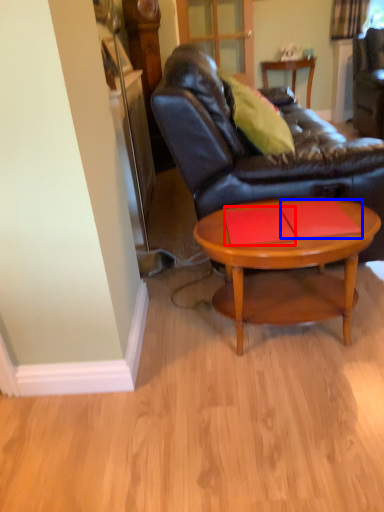
Question: Which object is further to the camera taking this photo, plank (highlighted by a red box) or plank (highlighted by a blue box)?

Choices:
 (A) plank
 (B) plank

Answer: (A)